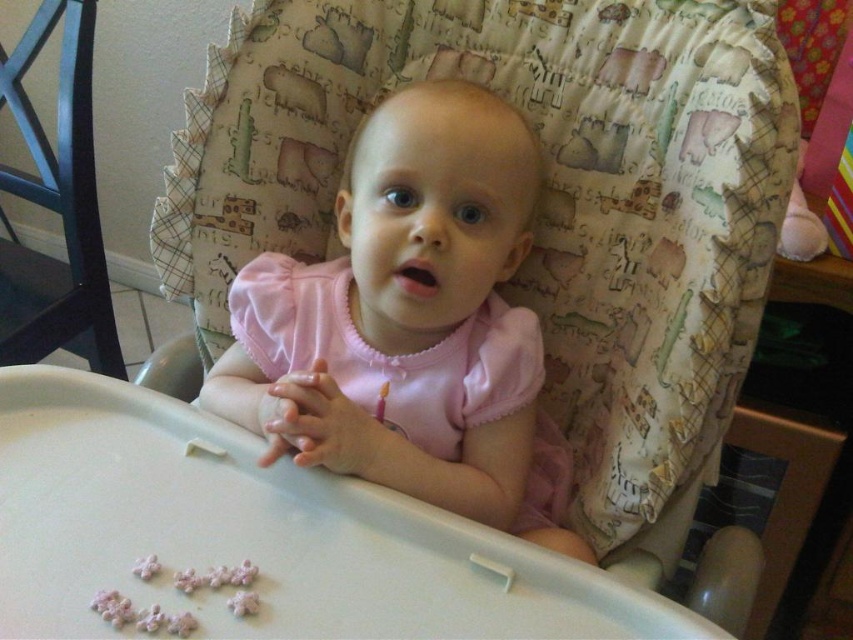
Question: Which point appears farthest from the camera in this image?

Choices:
 (A) (187, 577)
 (B) (51, 275)

Answer: (B)

Question: Is black plastic feeding chair at left thinner than pink sugar flowers at lower center?

Choices:
 (A) yes
 (B) no

Answer: (B)

Question: Which point is farther from the camera taking this photo?

Choices:
 (A) (195, 572)
 (B) (45, 35)
 (C) (566, 552)

Answer: (B)

Question: Does black plastic feeding chair at left have a larger size compared to pink sugar flowers at lower center?

Choices:
 (A) no
 (B) yes

Answer: (B)

Question: Can you confirm if pink matte dress at center is positioned below black plastic feeding chair at left?

Choices:
 (A) yes
 (B) no

Answer: (A)

Question: Estimate the real-world distances between objects in this image. Which object is farther from the pink matte dress at center?

Choices:
 (A) black plastic feeding chair at left
 (B) pink sugar flowers at lower center

Answer: (A)